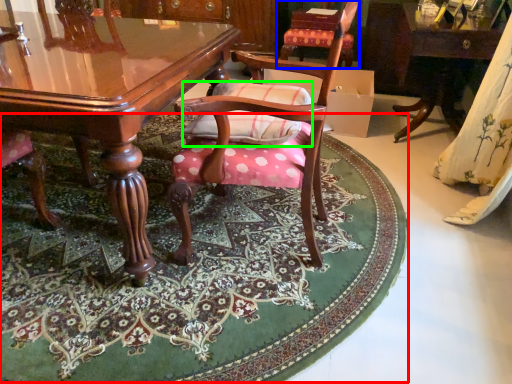
Question: Which object is the closest to the mat (highlighted by a red box)? Choose among these: chair (highlighted by a blue box) or pillow (highlighted by a green box).

Choices:
 (A) chair
 (B) pillow

Answer: (B)